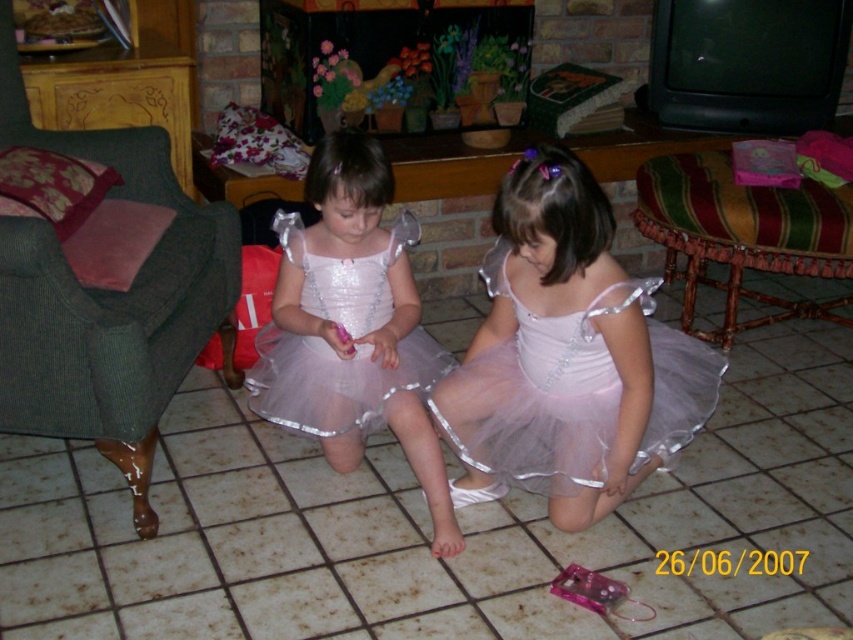
Question: In this image, where is pink tulle dress at center located relative to matte pink tulle dress at center?

Choices:
 (A) above
 (B) below

Answer: (B)

Question: Is green fabric armchair at left to the right of striped fabric cushion at right from the viewer's perspective?

Choices:
 (A) no
 (B) yes

Answer: (A)

Question: Which point is farther to the camera?

Choices:
 (A) (575, 394)
 (B) (645, 208)
 (C) (291, 348)
 (D) (122, 449)

Answer: (B)

Question: Which of the following is the closest to the observer?

Choices:
 (A) striped fabric cushion at right
 (B) matte pink tulle dress at center
 (C) pink tulle dress at center
 (D) green fabric armchair at left

Answer: (D)

Question: Does green fabric armchair at left have a larger size compared to striped fabric cushion at right?

Choices:
 (A) no
 (B) yes

Answer: (B)

Question: Which point appears closest to the camera in this image?

Choices:
 (A) (666, 408)
 (B) (337, 296)
 (C) (635, 220)

Answer: (A)